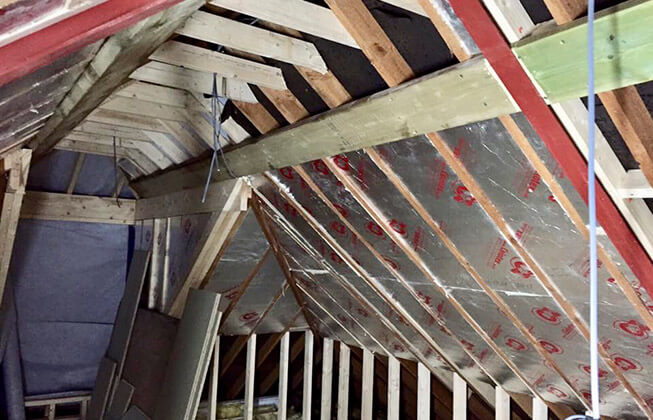
This screenshot has width=653, height=420. I want to click on hanging wires, so click(209, 168), click(219, 141), click(116, 176).